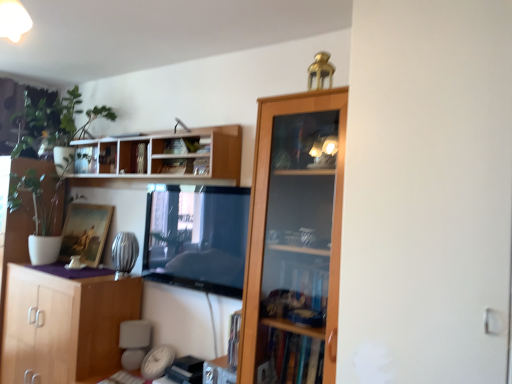
Question: In terms of width, does white wood shelves at upper center look wider or thinner when compared to hardcover book at upper center, the 2th book when ordered from left to right?

Choices:
 (A) thin
 (B) wide

Answer: (B)

Question: Considering the positions of point (206, 178) and point (181, 168), is point (206, 178) closer or farther from the camera than point (181, 168)?

Choices:
 (A) farther
 (B) closer

Answer: (B)

Question: Which object is the closest to the metallic silver book at upper center, the 1th book viewed from the left?

Choices:
 (A) white glossy screen door at right
 (B) matte wooden picture frame at center-left
 (C) wooden cabinet at upper right
 (D) hardcover book at upper center, which is the 1th book from right to left
 (E) wooden shelf at upper center

Answer: (D)

Question: Which object is positioned farthest from the white wood shelves at upper center?

Choices:
 (A) white glossy screen door at right
 (B) hardcover book at upper center, the 2th book when ordered from left to right
 (C) hardcover book at upper center, which is counted as the 3th book, starting from the left
 (D) matte wooden picture frame at center-left
 (E) wooden cabinet at lower left

Answer: (A)